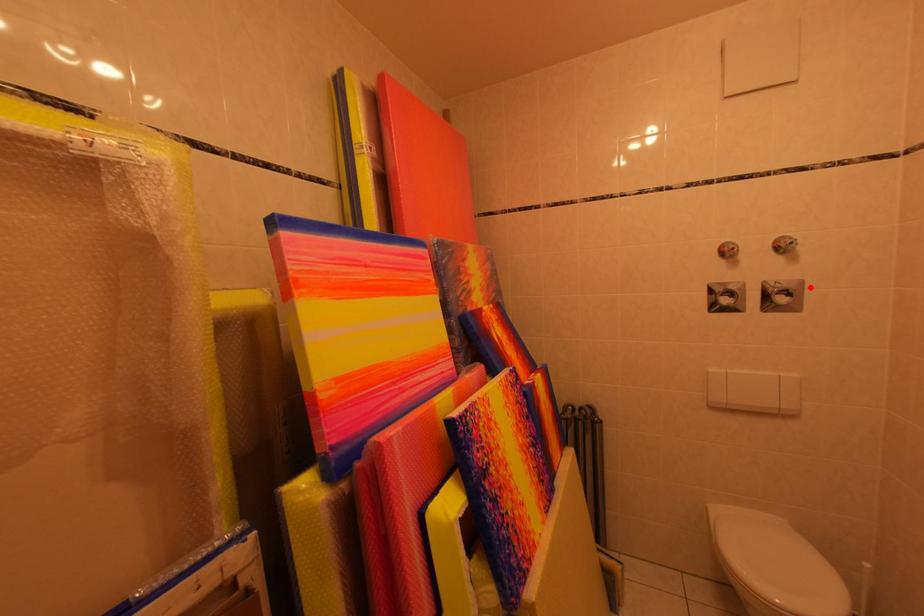
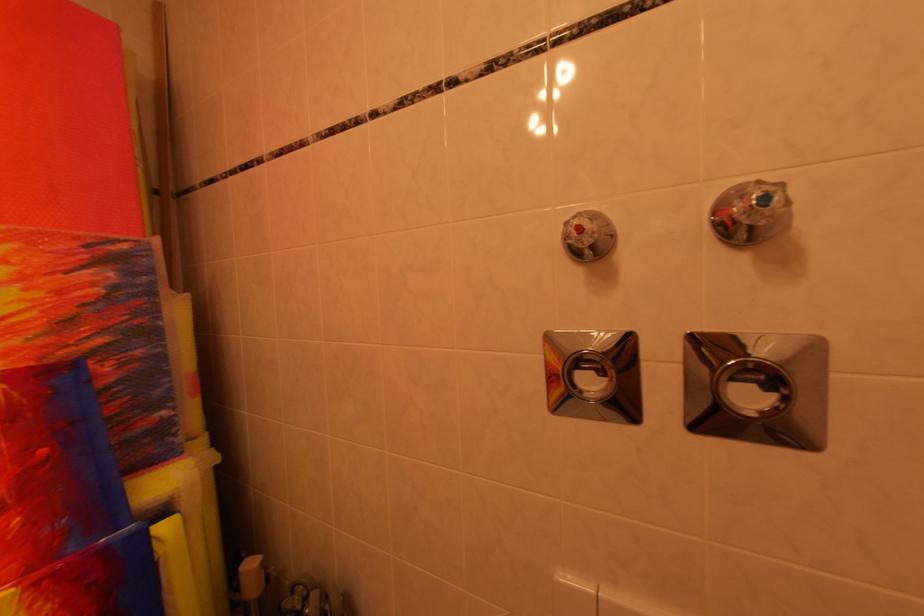
Where in the second image is the point corresponding to the highlighted location from the first image?

(824, 351)